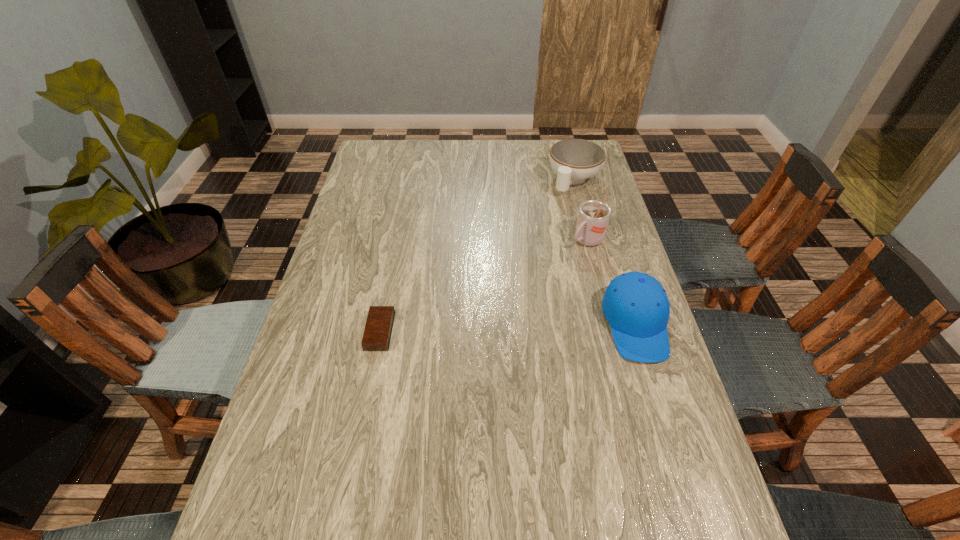
Locate an element on the screen. empty space that is in between the leftmost object and the cup is located at coordinates (483, 286).

This screenshot has height=540, width=960. Find the location of `empty space that is in between the cap and the chinaware`. empty space that is in between the cap and the chinaware is located at coordinates (605, 253).

You are a GUI agent. You are given a task and a screenshot of the screen. Output one action in this format:
    pyautogui.click(x=<x>, y=<y>)
    Task: Click on the vacant area that lies between the alarm clock and the cap
    The width and height of the screenshot is (960, 540).
    Given the screenshot: What is the action you would take?
    pyautogui.click(x=508, y=328)

Locate an element on the screen. The width and height of the screenshot is (960, 540). object that stands as the closest to the chinaware is located at coordinates (593, 216).

Locate an element on the screen. The height and width of the screenshot is (540, 960). the third closest object to the tallest object is located at coordinates (377, 334).

Locate an element on the screen. blank area in the image that satisfies the following two spatial constraints: 1. on the back side of the tallest object; 2. on the right side of the chinaware is located at coordinates (571, 180).